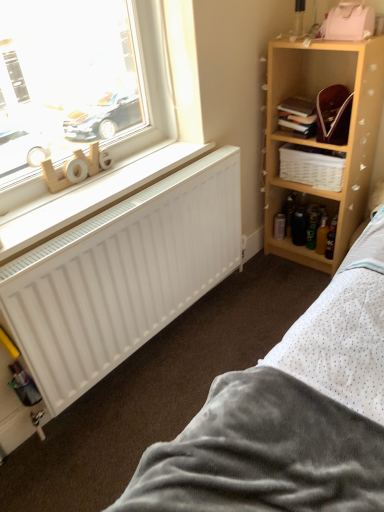
Question: Can you confirm if gray soft fabric bed at lower right is thinner than wooden shelf at upper right?

Choices:
 (A) no
 (B) yes

Answer: (A)

Question: From a real-world perspective, is gray soft fabric bed at lower right below wooden shelf at upper right?

Choices:
 (A) yes
 (B) no

Answer: (A)

Question: Can you confirm if gray soft fabric bed at lower right is positioned to the left of wooden shelf at upper right?

Choices:
 (A) no
 (B) yes

Answer: (B)

Question: Does gray soft fabric bed at lower right have a lesser height compared to wooden shelf at upper right?

Choices:
 (A) yes
 (B) no

Answer: (A)

Question: From the image's perspective, would you say gray soft fabric bed at lower right is positioned over wooden shelf at upper right?

Choices:
 (A) yes
 (B) no

Answer: (B)

Question: Based on their positions, is hardcover book at upper right located to the left or right of white woven basket at upper right?

Choices:
 (A) right
 (B) left

Answer: (B)

Question: From the image's perspective, is hardcover book at upper right positioned above or below white woven basket at upper right?

Choices:
 (A) above
 (B) below

Answer: (A)

Question: Is point (297, 131) closer or farther from the camera than point (284, 176)?

Choices:
 (A) closer
 (B) farther

Answer: (A)

Question: Considering the positions of hardcover book at upper right and white woven basket at upper right in the image, is hardcover book at upper right taller or shorter than white woven basket at upper right?

Choices:
 (A) short
 (B) tall

Answer: (A)

Question: In terms of height, does hardcover book at upper right look taller or shorter compared to wooden letters at window?

Choices:
 (A) short
 (B) tall

Answer: (A)

Question: From a real-world perspective, is hardcover book at upper right above or below wooden letters at window?

Choices:
 (A) below
 (B) above

Answer: (A)

Question: Looking at the image, does hardcover book at upper right seem bigger or smaller compared to wooden letters at window?

Choices:
 (A) small
 (B) big

Answer: (B)

Question: Is hardcover book at upper right inside the boundaries of wooden letters at window, or outside?

Choices:
 (A) inside
 (B) outside

Answer: (B)

Question: Visually, is hardcover book at upper right positioned to the left or to the right of white matte radiator at lower left?

Choices:
 (A) left
 (B) right

Answer: (B)

Question: From the image's perspective, is hardcover book at upper right above or below white matte radiator at lower left?

Choices:
 (A) below
 (B) above

Answer: (B)